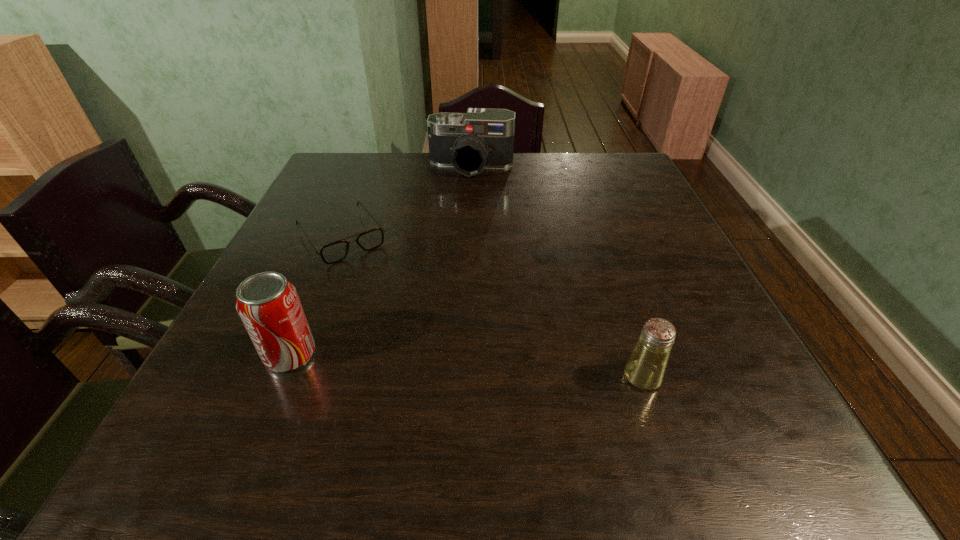
At what (x,y) coordinates should I click in order to perform the action: click on free space that satisfies the following two spatial constraints: 1. on the front side of the third tallest object; 2. on the right side of the farthest object. Please return your answer as a coordinate pair (x, y). The image size is (960, 540). Looking at the image, I should click on (466, 377).